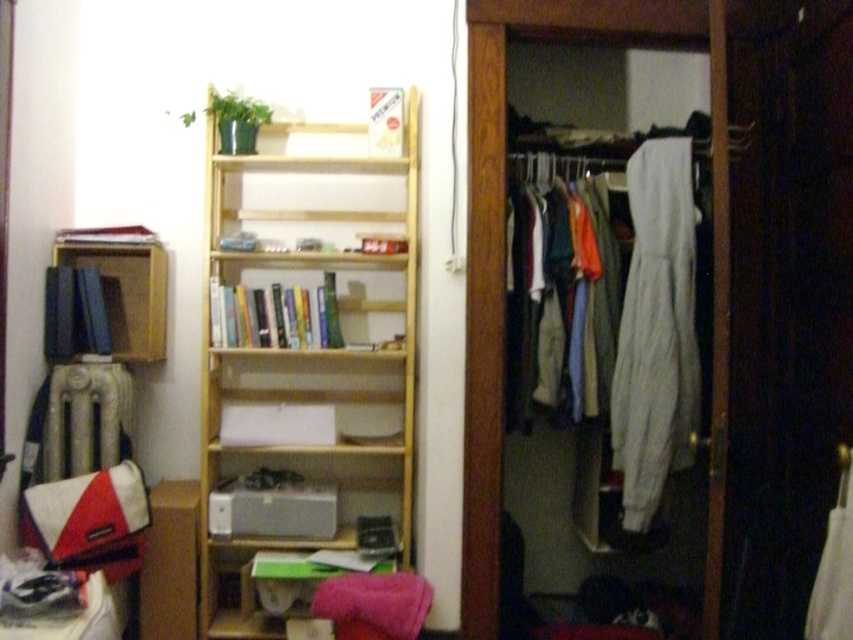
Which is in front, point (326, 148) or point (683, 460)?

Point (683, 460) is more forward.

Does light wood/bookshelf at center have a lesser height compared to white cotton hoodie at center?

In fact, light wood/bookshelf at center may be taller than white cotton hoodie at center.

Where is `light wood/bookshelf at center`? The image size is (853, 640). light wood/bookshelf at center is located at coordinates (306, 348).

Can you confirm if white fabric at center is shorter than white fleece sweatpants at center?

No, white fabric at center is not shorter than white fleece sweatpants at center.

Does white fabric at center appear on the left side of white fleece sweatpants at center?

Yes, white fabric at center is to the left of white fleece sweatpants at center.

Image resolution: width=853 pixels, height=640 pixels. Describe the element at coordinates (779, 310) in the screenshot. I see `white fabric at center` at that location.

Locate an element on the screen. white fabric at center is located at coordinates (779, 310).

Which is below, white fabric at center or matte wood bookshelf at left?

white fabric at center

Is the position of white fabric at center less distant than that of matte wood bookshelf at left?

Yes, it is in front of matte wood bookshelf at left.

Is point (654, 3) positioned behind point (157, 294)?

No, it is not.

I want to click on white fabric at center, so click(x=779, y=310).